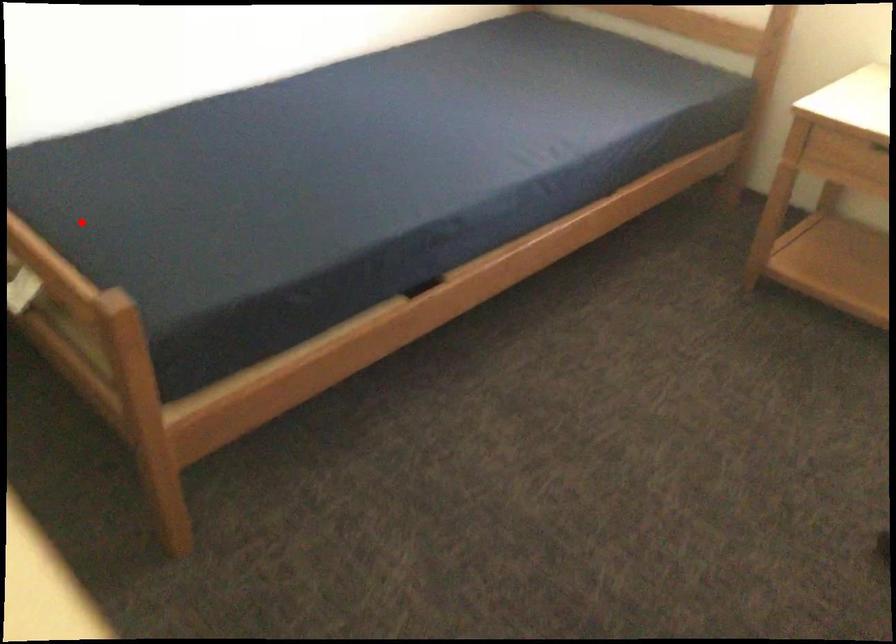
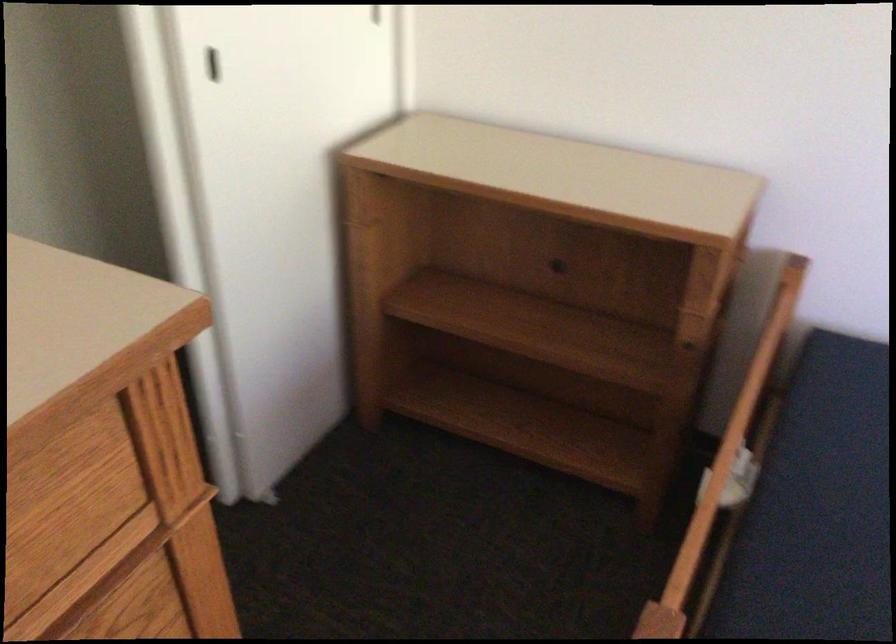
Where in the second image is the point corresponding to the highlighted location from the first image?

(846, 480)